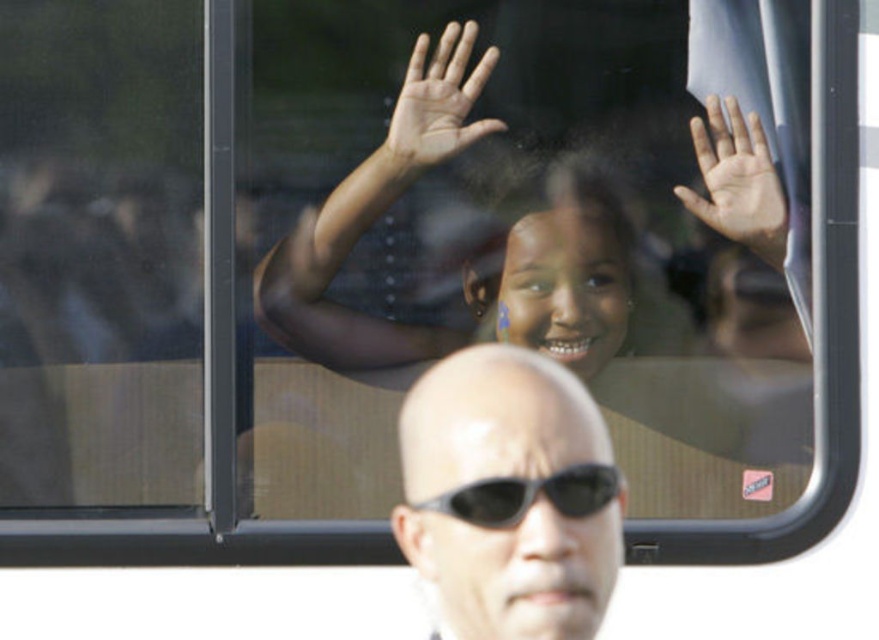
You are a photographer trying to capture a clear photo of the light brown skin at upper center and the light skin hand at upper center through the bus window. The camera has a minimum focusing distance of 12 inches. Can you take a clear photo of both subjects without moving the camera?

The light brown skin at upper center and the light skin hand at upper center are 10.33 inches apart. Since the minimum focusing distance is 12 inches, the camera cannot focus clearly on both subjects as they are closer than the required distance.

You are a passenger on the bus and notice two items at the upper center of your view. The items are the light skin hand at upper center and the black plastic goggles at upper center. Which item is positioned higher?

The light skin hand at upper center is positioned higher than the black plastic goggles at upper center because it has a greater height compared to the goggles.

You are a passenger on a bus and see the matte black girl at center and the black plastic goggles at upper center. Which object is closer to the left side of the bus window?

The black plastic goggles at upper center are closer to the left side of the bus window because the matte black girl at center is to the right of them.